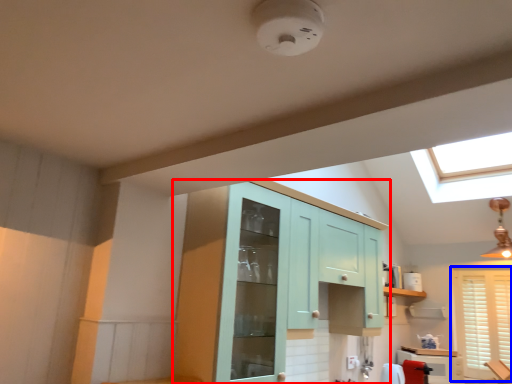
Question: Among these objects, which one is nearest to the camera, cabinetry (highlighted by a red box) or window (highlighted by a blue box)?

Choices:
 (A) cabinetry
 (B) window

Answer: (A)